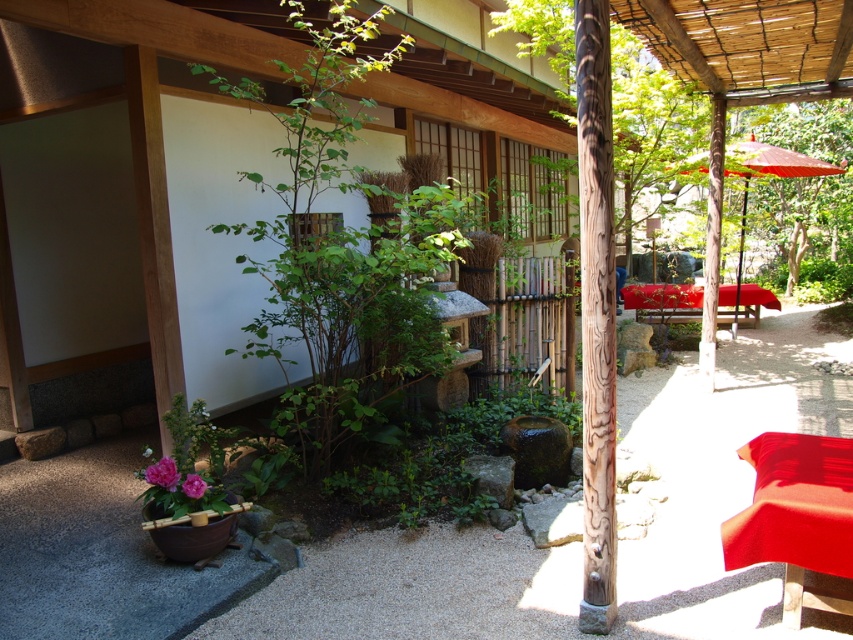
Question: Which object is farther from the camera taking this photo?

Choices:
 (A) green leafy plant at center
 (B) green leafy tree at upper right

Answer: (B)

Question: Can you confirm if wooden pole at center is wider than matte red cushion at center?

Choices:
 (A) yes
 (B) no

Answer: (B)

Question: Which of the following is the closest to the observer?

Choices:
 (A) (766, 536)
 (B) (590, 51)

Answer: (B)

Question: Is green leafy plant at center to the right of matte red cushion at center from the viewer's perspective?

Choices:
 (A) yes
 (B) no

Answer: (B)

Question: Can you confirm if green leafy plant at center is bigger than green leafy tree at upper right?

Choices:
 (A) yes
 (B) no

Answer: (B)

Question: Which object is farther from the camera taking this photo?

Choices:
 (A) wooden pole at center
 (B) matte red cushion at center
 (C) green leafy tree at upper right

Answer: (C)